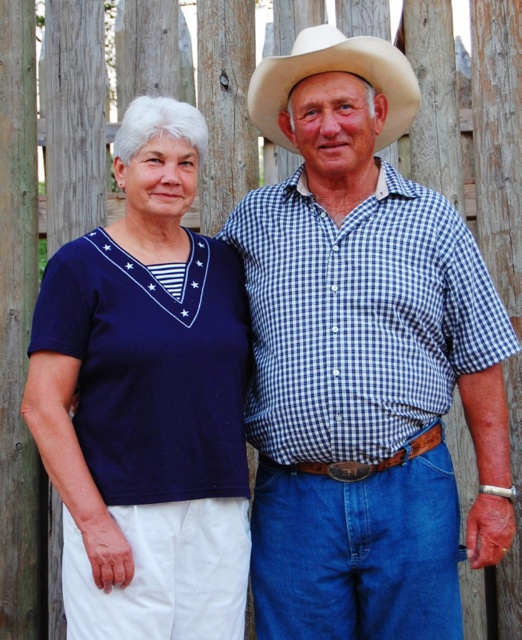
Between blue checkered shirt at center and navy blue fabric shirt at left, which one has more height?

blue checkered shirt at center is taller.

Between point (420, 321) and point (98, 275), which one is positioned behind?

Point (420, 321)

Identify the location of blue checkered shirt at center. Image resolution: width=522 pixels, height=640 pixels. (362, 360).

You are a GUI agent. You are given a task and a screenshot of the screen. Output one action in this format:
    pyautogui.click(x=<x>, y=<y>)
    Task: Click on the blue checkered shirt at center
    
    Given the screenshot: What is the action you would take?
    pyautogui.click(x=362, y=360)

Measure the distance between point (298, 314) and camera.

A distance of 14.38 feet exists between point (298, 314) and camera.

Is point (295, 349) positioned before point (324, 33)?

Yes, point (295, 349) is in front of point (324, 33).

Locate an element on the screen. This screenshot has width=522, height=640. blue checkered shirt at center is located at coordinates (362, 360).

Is navy blue fabric shirt at left behind white felt cowboy hat at upper center?

That is False.

I want to click on navy blue fabric shirt at left, so click(147, 401).

What do you see at coordinates (147, 401) in the screenshot? I see `navy blue fabric shirt at left` at bounding box center [147, 401].

At what (x,y) coordinates should I click in order to perform the action: click on navy blue fabric shirt at left. Please return your answer as a coordinate pair (x, y). Looking at the image, I should click on (147, 401).